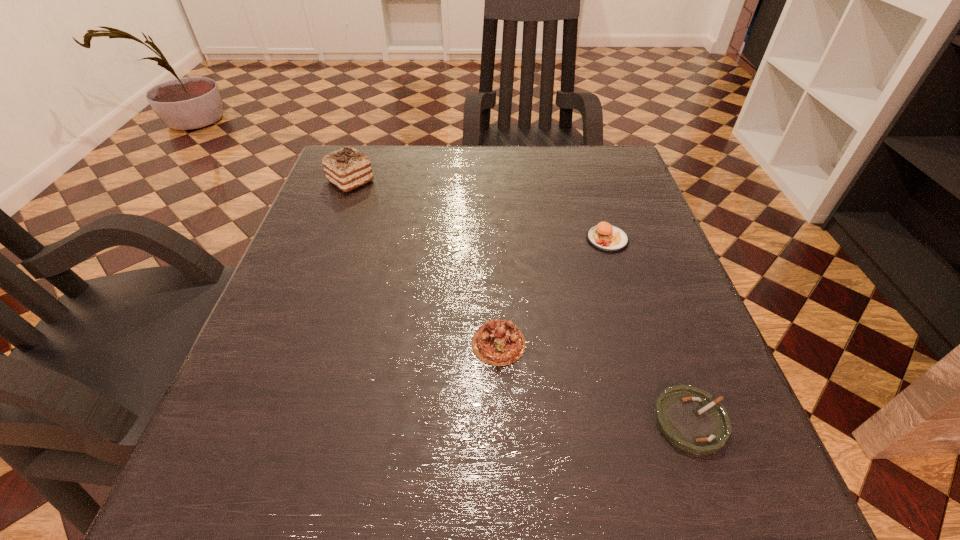
The height and width of the screenshot is (540, 960). What are the coordinates of `free location located 0.270m on the back of the nearest object` in the screenshot? It's located at (635, 265).

Where is `object present at the far edge`? The image size is (960, 540). object present at the far edge is located at coordinates (347, 168).

Image resolution: width=960 pixels, height=540 pixels. Find the location of `object that is positioned at the left edge`. object that is positioned at the left edge is located at coordinates tap(347, 168).

Where is `patty that is at the right edge`? This screenshot has height=540, width=960. patty that is at the right edge is located at coordinates (605, 237).

Find the location of a particular element. The height and width of the screenshot is (540, 960). ashtray that is positioned at the right edge is located at coordinates (690, 419).

Where is `object that is positioned at the far left corner`? object that is positioned at the far left corner is located at coordinates (347, 168).

Locate an element on the screen. Image resolution: width=960 pixels, height=540 pixels. vacant space at the far edge of the desktop is located at coordinates (464, 156).

In the image, there is a desktop. At what (x,y) coordinates should I click in order to perform the action: click on vacant region at the near edge. Please return your answer as a coordinate pair (x, y). This screenshot has height=540, width=960. Looking at the image, I should click on (563, 530).

This screenshot has width=960, height=540. In order to click on free space at the left edge of the desktop in this screenshot , I will do `click(347, 300)`.

This screenshot has width=960, height=540. Find the location of `free space at the right edge of the desktop`. free space at the right edge of the desktop is located at coordinates (661, 369).